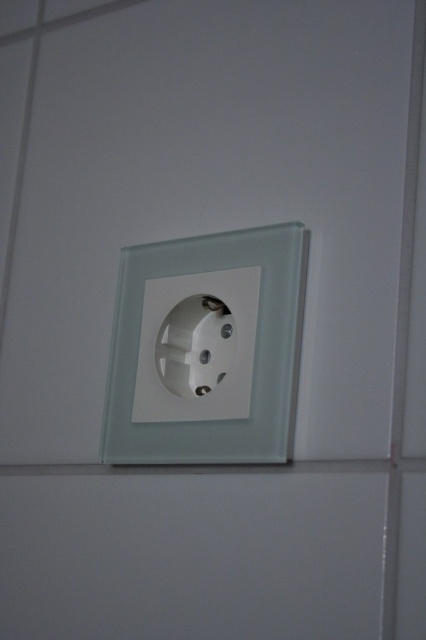
Consider the image. You have a device with a wide plug that requires a socket wider than 5 cm. Looking at the image, can you determine if the transparent glass socket at center or the white plastic socket at center can accommodate it?

The transparent glass socket at center might be wider than white plastic socket at center, so it could potentially accommodate the wide plug if it exceeds 5 cm. However, the exact width isn

You are holding a small flashlight and want to shine it directly on the transparent glass socket at center. Given that your current position is at point coordinates point (207, 348), can you determine if you are already shining the flashlight on the correct spot?

The point (207, 348) corresponds to the transparent glass socket at center, so yes, you are already shining the flashlight on the correct spot.

You are holding a measuring tool and need to determine which of the two points, point (250, 404) or point (256, 280), is nearer to you in the image. Based on the scene, which point is closer?

Point (250, 404) is closer to the viewer than point (256, 280) according to the description.